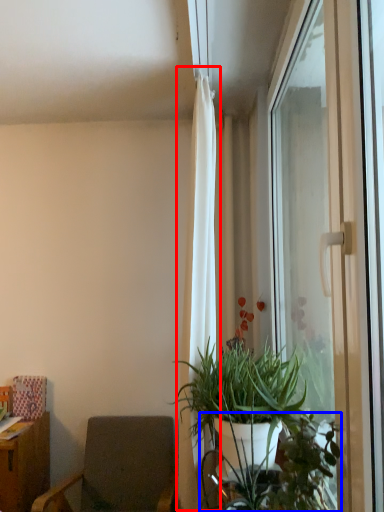
Question: Which point is further to the camera, curtain (highlighted by a red box) or vegetation (highlighted by a blue box)?

Choices:
 (A) curtain
 (B) vegetation

Answer: (A)